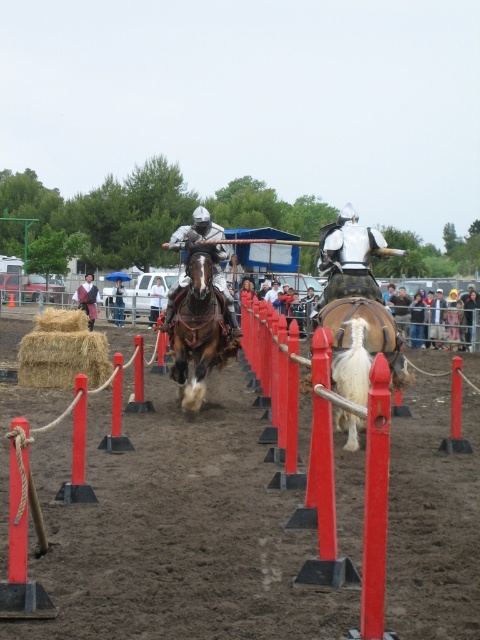
Question: Is white fabric jacket at right above white fabric umbrella at center?

Choices:
 (A) yes
 (B) no

Answer: (A)

Question: Which is farther from the leather jacket at left?

Choices:
 (A) beige straw bale at lower left
 (B) brown leather horse at center
 (C) white fuzzy horse at center

Answer: (C)

Question: Is white fabric jacket at right thinner than shiny silver armor at center?

Choices:
 (A) no
 (B) yes

Answer: (A)

Question: Based on their relative distances, which object is nearer to the white fabric umbrella at center?

Choices:
 (A) smooth leather helmet at center
 (B) beige straw bale at lower left
 (C) white woolen horse at center
 (D) dirt field at center

Answer: (A)

Question: Which of the following is the closest to the observer?

Choices:
 (A) (43, 324)
 (B) (180, 230)
 (C) (355, 397)
 (D) (152, 285)

Answer: (C)

Question: Does brown leather horse at center have a lesser width compared to white fabric umbrella at center?

Choices:
 (A) no
 (B) yes

Answer: (B)